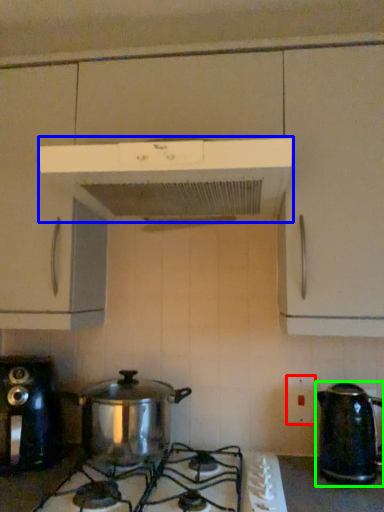
Question: Considering the real-world distances, which object is closest to electric outlet (highlighted by a red box)? home appliance (highlighted by a blue box) or kettle (highlighted by a green box).

Choices:
 (A) home appliance
 (B) kettle

Answer: (B)